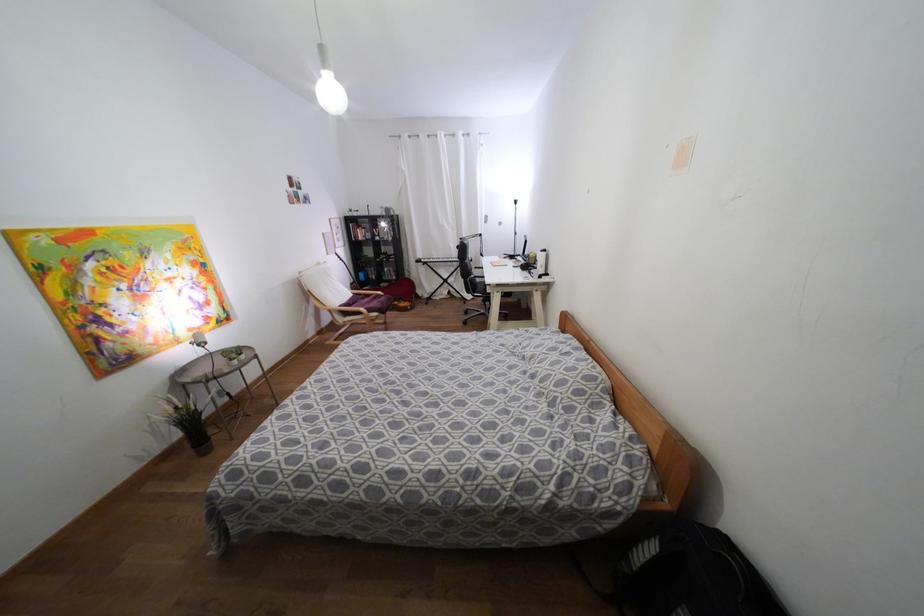
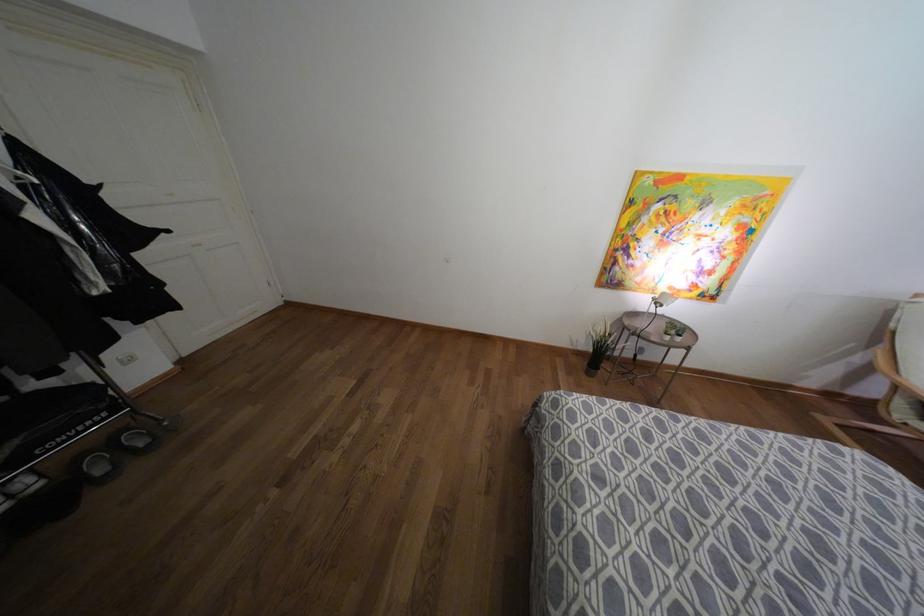
The first image is from the beginning of the video and the second image is from the end. How did the camera likely rotate when shooting the video?

The rotation direction of the camera is left-down.